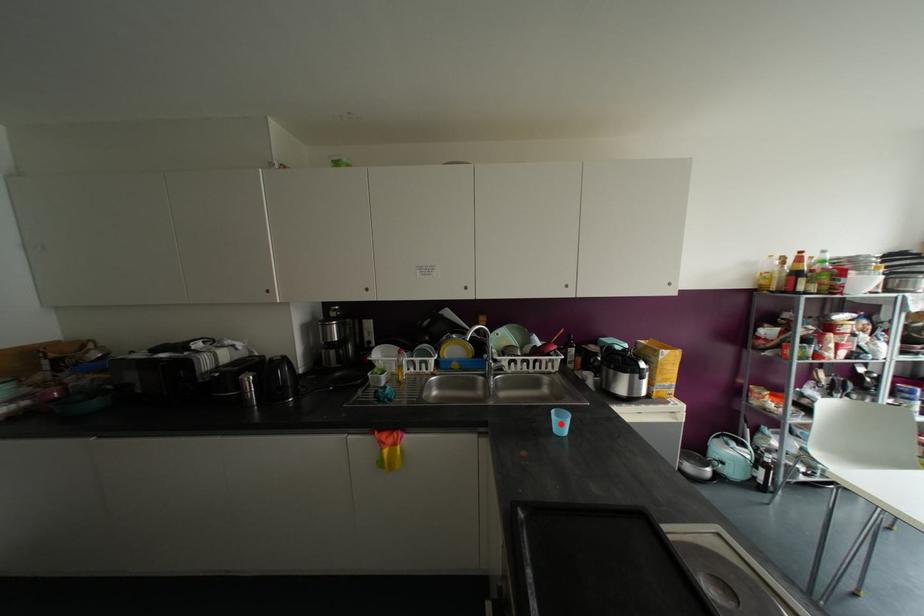
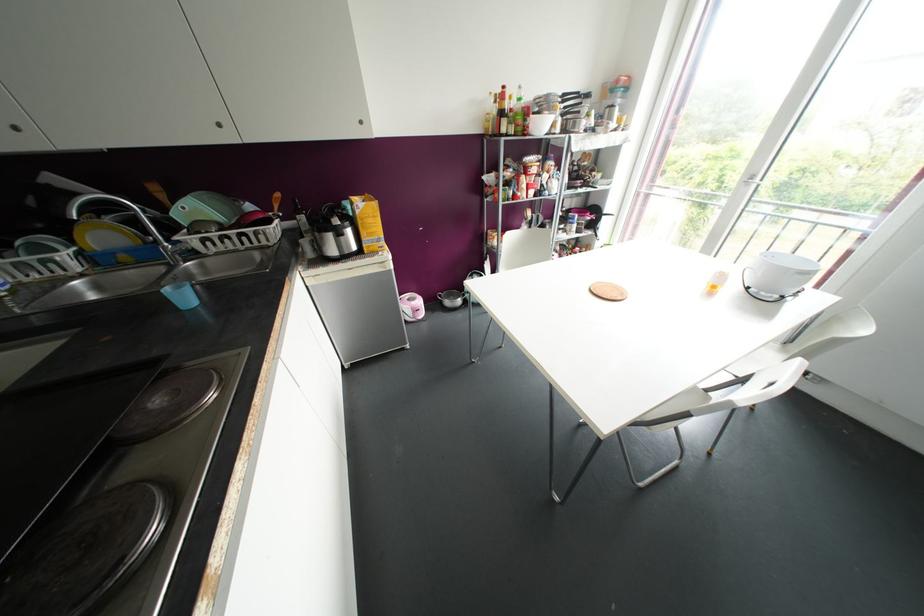
Question: I am providing you with two images of the same scene from different viewpoints. A red point is marked on the first image. Can you still see the location of the red point in image 2?

Choices:
 (A) Yes
 (B) No

Answer: (A)